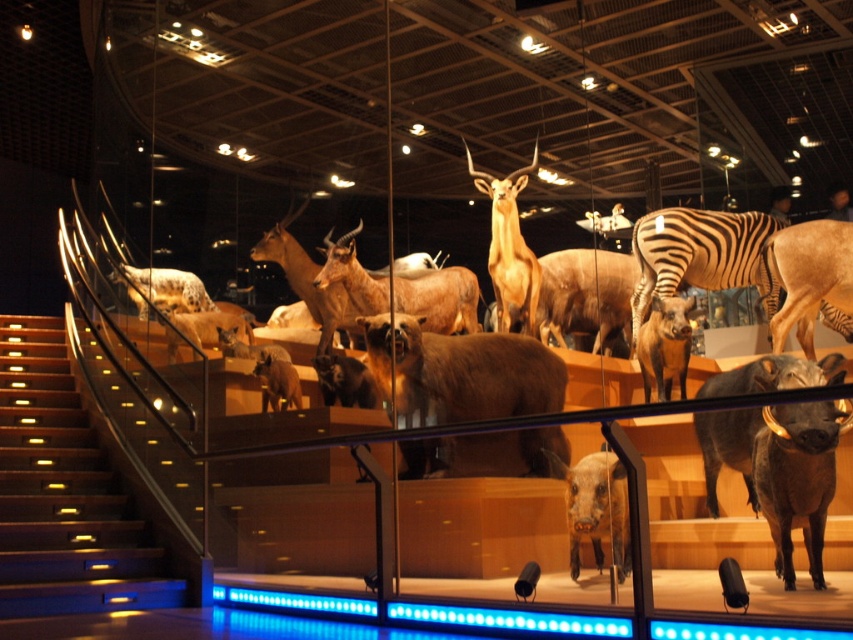
You are a museum visitor who wants to take a photo of both the brown furry bear at center and the brown matte pig at center. Since your camera can only focus on one subject at a time, which animal should you zoom in on first to ensure it fills the frame properly?

The brown furry bear at center has a larger width than the brown matte pig at center, so you should zoom in on the brown furry bear at center first to ensure it fills the frame properly.